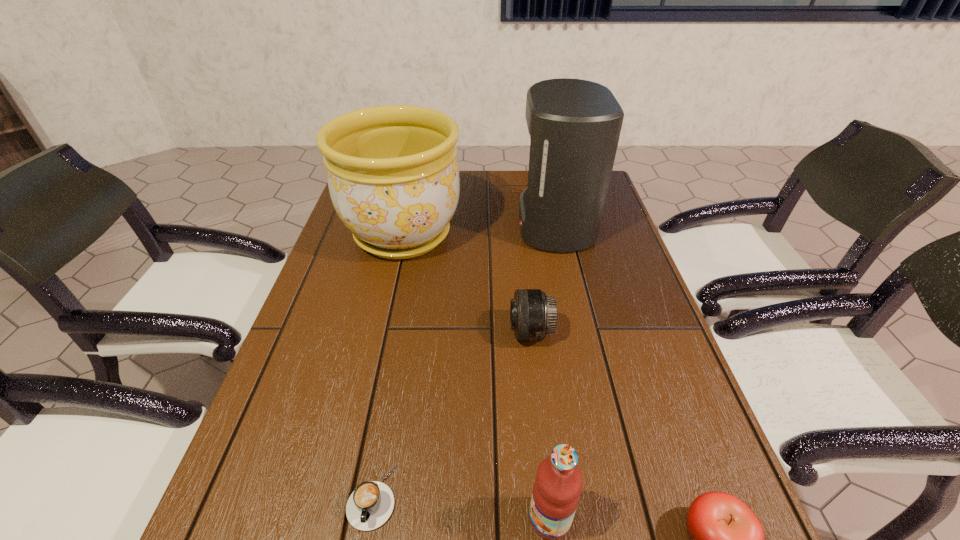
In order to click on free spot between the shortest object and the fifth shortest object in this screenshot , I will do `click(388, 366)`.

At what (x,y) coordinates should I click in order to perform the action: click on free space between the tallest object and the cappuccino. Please return your answer as a coordinate pair (x, y). Image resolution: width=960 pixels, height=540 pixels. Looking at the image, I should click on (464, 361).

At what (x,y) coordinates should I click in order to perform the action: click on empty space between the tallest object and the second tallest object. Please return your answer as a coordinate pair (x, y). Looking at the image, I should click on (479, 230).

The height and width of the screenshot is (540, 960). I want to click on vacant area that lies between the fourth nearest object and the coffee maker, so (x=542, y=279).

This screenshot has width=960, height=540. I want to click on object that ranks as the third closest to the tallest object, so click(370, 505).

The image size is (960, 540). In order to click on object identified as the fourth closest to the shortest object in this screenshot , I will do `click(393, 176)`.

Where is `free space that satisfies the following two spatial constraints: 1. on the front-facing side of the fourth nearest object; 2. with the handle on the side of the cappuccino`? This screenshot has height=540, width=960. free space that satisfies the following two spatial constraints: 1. on the front-facing side of the fourth nearest object; 2. with the handle on the side of the cappuccino is located at coordinates (550, 497).